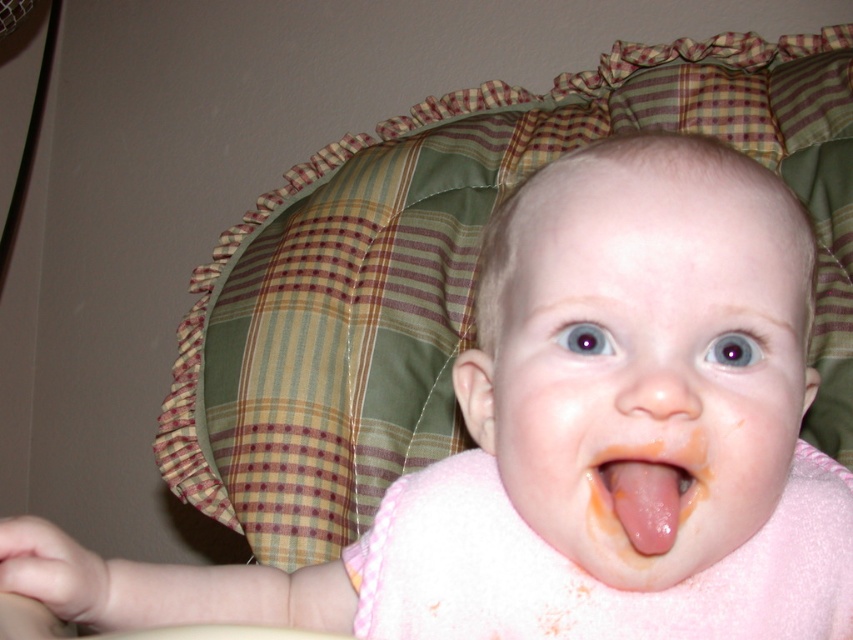
You are a photographer taking a picture of a baby in a high chair. You notice the pink fabric at center and the pink smooth tongue at center. Which object is positioned to the right side in the image?

The pink fabric at center is positioned to the right of the pink smooth tongue at center.

From the picture: The baby is sitting in a high chair with a plaid cushion. You need to place a small toy between the pink fabric at center and the pink smooth tongue at center. Which direction should you place the toy so it doesn

The pink fabric at center is taller than the pink smooth tongue at center. Therefore, you should place the toy below the pink fabric at center and above the pink smooth tongue at center to position it between them.

You are a photographer trying to capture a closeup of the pink fabric at center. You need to position your camera so that it is exactly 12 inches away from the fabric. Based on the scene, is your current position sufficient?

The pink fabric at center and camera are 12.34 inches apart, so yes, your current position is sufficient as it is slightly more than the required 12 inches.